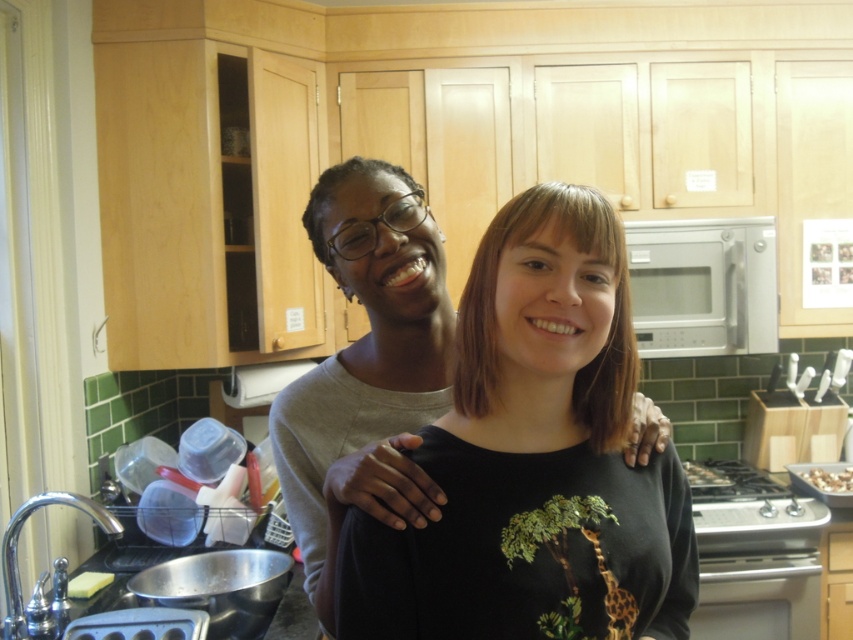
You are a delivery person who needs to place a small package on the kitchen counter. The package must be placed exactly at the coordinates given for the matte gray sweater at center. Where should you place the package?

The package should be placed at the coordinates point (x=367, y=369) where the matte gray sweater at center is located.

You are a chef preparing to place a new kitchen appliance on the counter. The matte gray sweater at center is currently occupying the space. Can the satin silver microwave at right be placed in that spot if the sweater is removed?

The matte gray sweater at center has a larger size compared to satin silver microwave at right, so removing the sweater would leave enough space for the microwave to fit in that spot.